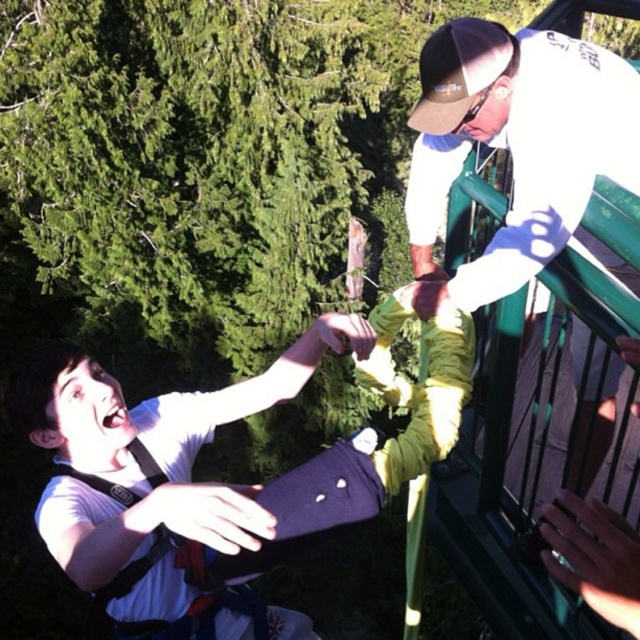
You are standing at the point marked by the coordinates point [392,397]. You want to reach a tree located 2 meters away from your current position. Can you safely walk straight ahead without any obstacles? Please consider the distance between you and the viewer as given in the scene.

The distance between you and the viewer is 1.79 meters, which is less than the 2 meters required to reach the tree. Therefore, you can safely walk straight ahead for 1.79 meters before needing to adjust your path or check for further clearance.

You are a photographer standing at the base of the cliff where the two climbers are positioned. You want to take a photo that includes both the white matte shirt at center and the white matte baseball cap at upper right. Which object should you focus on first to ensure both are in frame?

The white matte shirt at center is shorter than the white matte baseball cap at upper right, so you should focus on the white matte shirt at center first to ensure both are in frame.

You are standing at the origin point in the scene. A drone is flying towards the white matte shirt at center. What are the coordinates where the drone will land?

The drone will land at coordinates point (211,436) where the white matte shirt at center is located.